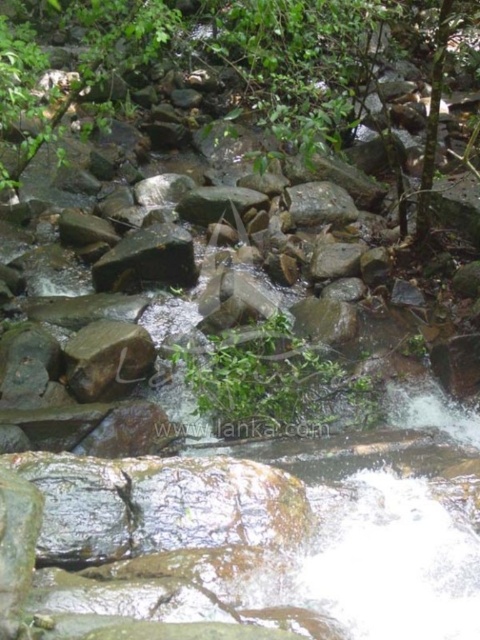
Question: Is green leafy tree at center to the right of brown rough rock at center from the viewer's perspective?

Choices:
 (A) yes
 (B) no

Answer: (A)

Question: Can you confirm if green leafy tree at center is smaller than green mossy rock at center?

Choices:
 (A) no
 (B) yes

Answer: (A)

Question: Among these objects, which one is farthest from the camera?

Choices:
 (A) brown rough rock at center
 (B) green rough stone at center
 (C) green mossy rock at center
 (D) green leafy tree at center

Answer: (C)

Question: In this image, where is green leafy tree at center located relative to brown rough rock at center?

Choices:
 (A) below
 (B) above

Answer: (B)

Question: Which point is closer to the camera?

Choices:
 (A) (76, 353)
 (B) (352, 212)
 (C) (346, 115)
 (D) (189, 268)

Answer: (A)

Question: Which of the following is the farthest from the observer?

Choices:
 (A) green leafy tree at center
 (B) green rough stone at center

Answer: (B)